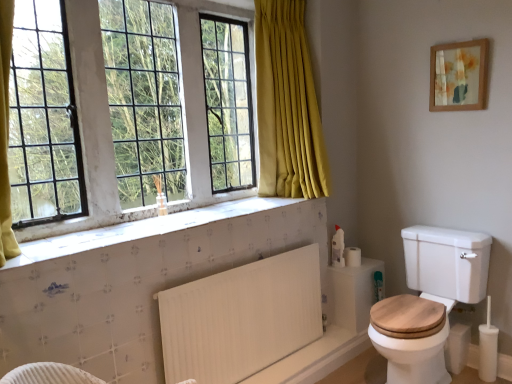
At what (x,y) coordinates should I click in order to perform the action: click on white wood toilet at lower right. Please return your answer as a coordinate pair (x, y). The width and height of the screenshot is (512, 384). Looking at the image, I should click on click(x=429, y=301).

You are a GUI agent. You are given a task and a screenshot of the screen. Output one action in this format:
    pyautogui.click(x=<x>, y=<y>)
    Task: Click on the white ribbed radiator at lower center
    
    Given the screenshot: What is the action you would take?
    pyautogui.click(x=241, y=318)

Locate an element on the screen. This screenshot has height=384, width=512. white glass window at upper left is located at coordinates pyautogui.click(x=90, y=130).

The image size is (512, 384). I want to click on wooden framed artwork at upper right, so point(458,76).

The width and height of the screenshot is (512, 384). I want to click on white textured tile at lower center, so click(143, 229).

Find the location of a particular element. This screenshot has width=512, height=384. white matte toilet paper at right is located at coordinates (352, 256).

From a real-world perspective, is white ribbed radiator at lower center physically above white wood toilet at lower right?

Yes, from a real-world perspective, white ribbed radiator at lower center is above white wood toilet at lower right.

From the image's perspective, which object appears higher, white ribbed radiator at lower center or white wood toilet at lower right?

white wood toilet at lower right.

Between white ribbed radiator at lower center and white wood toilet at lower right, which one has larger width?

Wider between the two is white wood toilet at lower right.

Image resolution: width=512 pixels, height=384 pixels. I want to click on toilet located underneath the white ribbed radiator at lower center (from a real-world perspective), so click(x=429, y=301).

From a real-world perspective, who is located higher, wooden framed artwork at upper right or white wood toilet at lower right?

From a 3D spatial view, wooden framed artwork at upper right is above.

Is white wood toilet at lower right surrounded by wooden framed artwork at upper right?

No, wooden framed artwork at upper right does not contain white wood toilet at lower right.

Between wooden framed artwork at upper right and white wood toilet at lower right, which one has larger width?

white wood toilet at lower right is wider.

Could you tell me if wooden framed artwork at upper right is turned towards white wood toilet at lower right?

No, wooden framed artwork at upper right is not facing towards white wood toilet at lower right.

Is white ribbed radiator at lower center smaller than wooden framed artwork at upper right?

No.

Does white ribbed radiator at lower center have a lesser width compared to wooden framed artwork at upper right?

No.

Does white ribbed radiator at lower center come behind wooden framed artwork at upper right?

That is False.

From a real-world perspective, which is physically above, white ribbed radiator at lower center or wooden framed artwork at upper right?

wooden framed artwork at upper right is physically above.

Considering the sizes of objects white ribbed radiator at lower center and white glass window at upper left in the image provided, who is bigger, white ribbed radiator at lower center or white glass window at upper left?

With larger size is white glass window at upper left.

Is white ribbed radiator at lower center with white glass window at upper left?

No, white ribbed radiator at lower center is not with white glass window at upper left.

The image size is (512, 384). I want to click on window that appears above the white ribbed radiator at lower center (from a real-world perspective), so click(90, 130).

From the image's perspective, is white ribbed radiator at lower center over white glass window at upper left?

Incorrect, from the image's perspective, white ribbed radiator at lower center is lower than white glass window at upper left.

From the picture: Based on their sizes in the image, would you say white textured tile at lower center is bigger or smaller than white glass window at upper left?

Considering their sizes, white textured tile at lower center takes up less space than white glass window at upper left.

Can you confirm if white textured tile at lower center is wider than white glass window at upper left?

Yes.

Considering the sizes of objects white textured tile at lower center and white glass window at upper left in the image provided, who is taller, white textured tile at lower center or white glass window at upper left?

white glass window at upper left.

Would you say white textured tile at lower center is inside or outside white glass window at upper left?

white textured tile at lower center cannot be found inside white glass window at upper left.

You are a GUI agent. You are given a task and a screenshot of the screen. Output one action in this format:
    pyautogui.click(x=<x>, y=<y>)
    Task: Click on the window above the white matte toilet paper at right (from a real-world perspective)
    The height and width of the screenshot is (384, 512).
    Given the screenshot: What is the action you would take?
    pyautogui.click(x=90, y=130)

Is white matte toilet paper at right beside white glass window at upper left?

white matte toilet paper at right and white glass window at upper left are not in contact.

From a real-world perspective, is white matte toilet paper at right positioned under white glass window at upper left based on gravity?

Indeed, from a real-world perspective, white matte toilet paper at right is positioned beneath white glass window at upper left.

Is white matte toilet paper at right looking in the opposite direction of white glass window at upper left?

No, white matte toilet paper at right is not facing away from white glass window at upper left.

From the image's perspective, between white textured tile at lower center and white ribbed radiator at lower center, which one is located above?

white textured tile at lower center is shown above in the image.

Is white textured tile at lower center positioned far away from white ribbed radiator at lower center?

No, white textured tile at lower center is in close proximity to white ribbed radiator at lower center.

Looking at this image, is white textured tile at lower center oriented away from white ribbed radiator at lower center?

No.

How many degrees apart are the facing directions of white textured tile at lower center and white ribbed radiator at lower center?

The facing directions of white textured tile at lower center and white ribbed radiator at lower center are 0.562 degrees apart.

This screenshot has width=512, height=384. Identify the location of toilet that is on the right side of white ribbed radiator at lower center. (429, 301).

Find the location of a particular element. toilet on the left of wooden framed artwork at upper right is located at coordinates (429, 301).

Considering their positions, is white ribbed radiator at lower center positioned closer to wooden framed artwork at upper right than white textured tile at lower center?

Based on the image, white textured tile at lower center appears to be nearer to wooden framed artwork at upper right.

Considering their positions, is wooden framed artwork at upper right positioned further to white ribbed radiator at lower center than white wood toilet at lower right?

The object further to white ribbed radiator at lower center is wooden framed artwork at upper right.

Estimate the real-world distances between objects in this image. Which object is further from white glass window at upper left, wooden framed artwork at upper right or white ribbed radiator at lower center?

Based on the image, wooden framed artwork at upper right appears to be further to white glass window at upper left.

Estimate the real-world distances between objects in this image. Which object is closer to white matte toilet paper at right, white glass window at upper left or white ribbed radiator at lower center?

white ribbed radiator at lower center lies closer to white matte toilet paper at right than the other object.

When comparing their distances from white wood toilet at lower right, does white textured tile at lower center or white matte toilet paper at right seem closer?

white matte toilet paper at right.

Which object lies further to the anchor point white textured tile at lower center, white ribbed radiator at lower center or wooden framed artwork at upper right?

wooden framed artwork at upper right.

Which object lies nearer to the anchor point white glass window at upper left, white textured tile at lower center or wooden framed artwork at upper right?

white textured tile at lower center lies closer to white glass window at upper left than the other object.

From the image, which object appears to be nearer to wooden framed artwork at upper right, white glass window at upper left or white textured tile at lower center?

white textured tile at lower center.

The image size is (512, 384). I want to click on toilet paper between white textured tile at lower center and white wood toilet at lower right in the horizontal direction, so click(x=352, y=256).

This screenshot has height=384, width=512. I want to click on radiator situated between white glass window at upper left and wooden framed artwork at upper right from left to right, so click(x=241, y=318).

Where is `radiator positioned between white textured tile at lower center and white matte toilet paper at right from near to far`? Image resolution: width=512 pixels, height=384 pixels. radiator positioned between white textured tile at lower center and white matte toilet paper at right from near to far is located at coordinates (241, 318).

Locate an element on the screen. radiator located between white glass window at upper left and white wood toilet at lower right in the left-right direction is located at coordinates (241, 318).